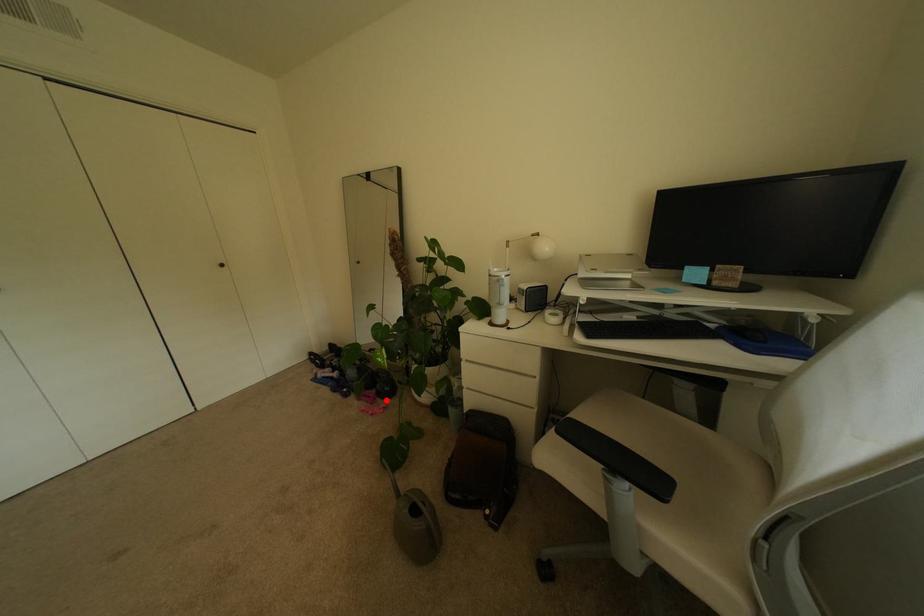
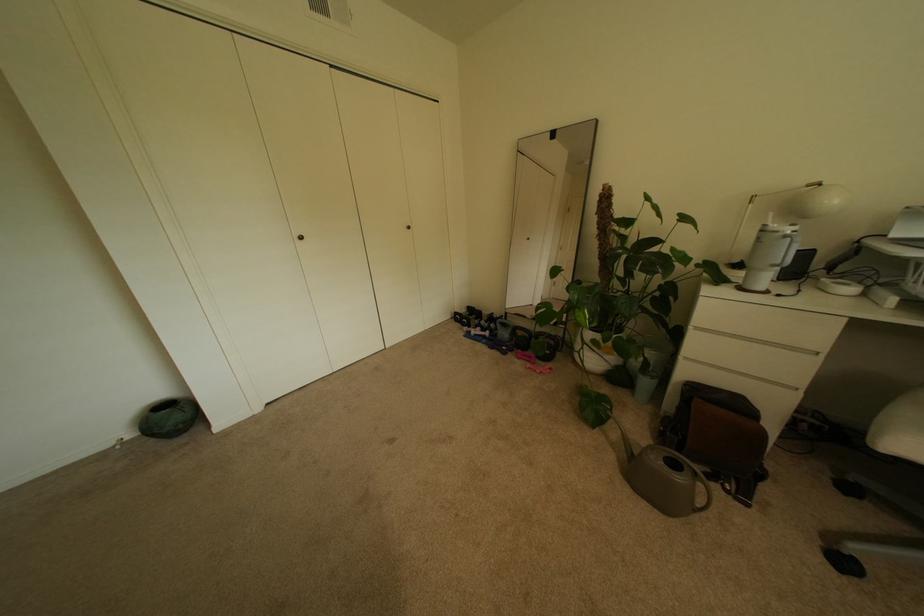
Question: A red point is marked in image1. In image2, is the corresponding 3D point closer to the camera or farther? Reply with the corresponding letter.

Choices:
 (A) The corresponding 3D point is closer.
 (B) The corresponding 3D point is farther.

Answer: (A)